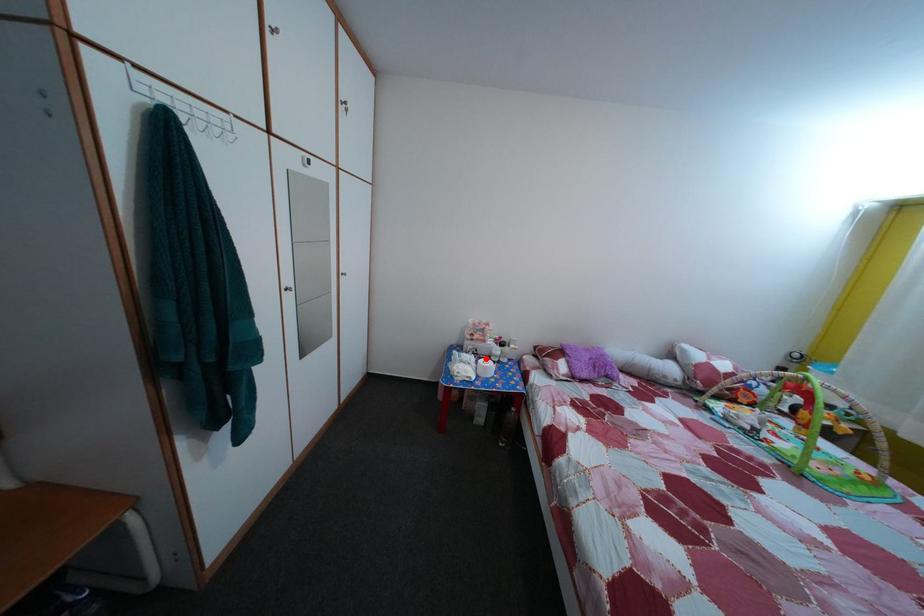
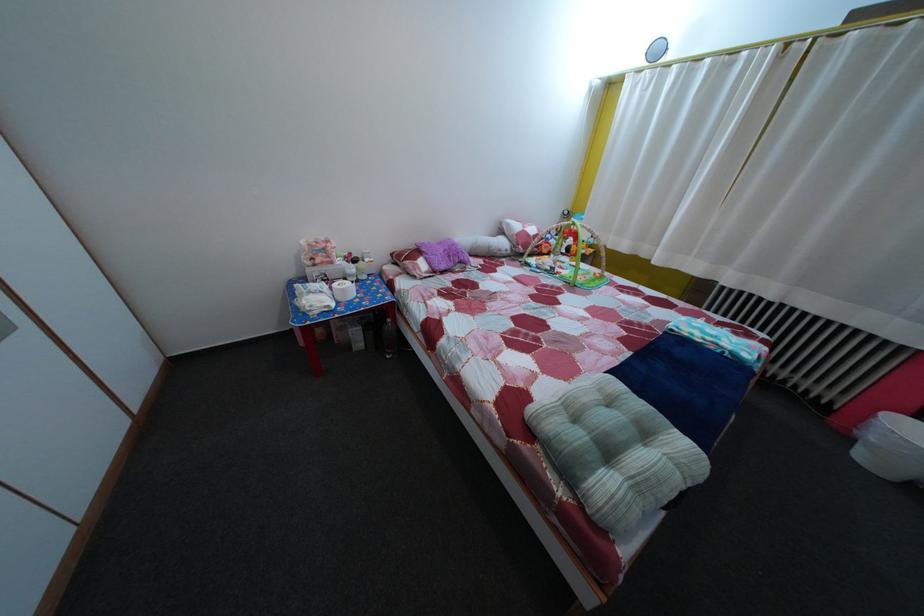
Question: I am providing you with two images of the same scene from different viewpoints. In image1, a red point is highlighted. Considering the same 3D point in image2, which of the following is correct?

Choices:
 (A) It is closer
 (B) It is farther

Answer: (A)